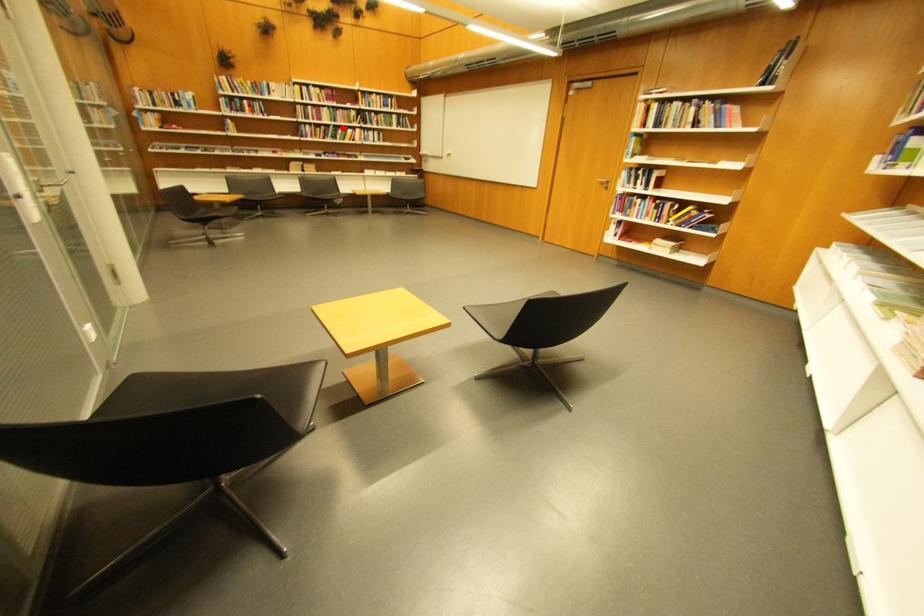
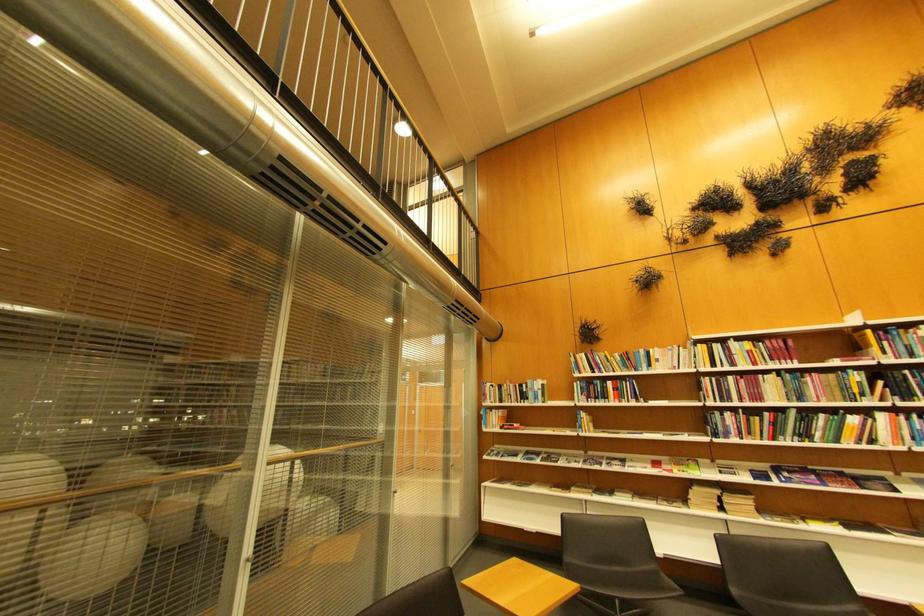
Question: I am providing you with two images of the same scene from different viewpoints. A red point is shown in image1. For the corresponding object point in image2, is it positioned nearer or farther from the camera?

Choices:
 (A) Nearer
 (B) Farther

Answer: (B)